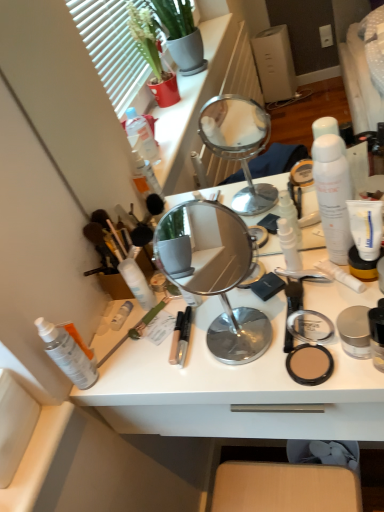
In order to click on vacant area located to the right-hand side of white matte lotion at center, which is counted as the 3th toiletry, starting from the left in this screenshot , I will do `click(198, 307)`.